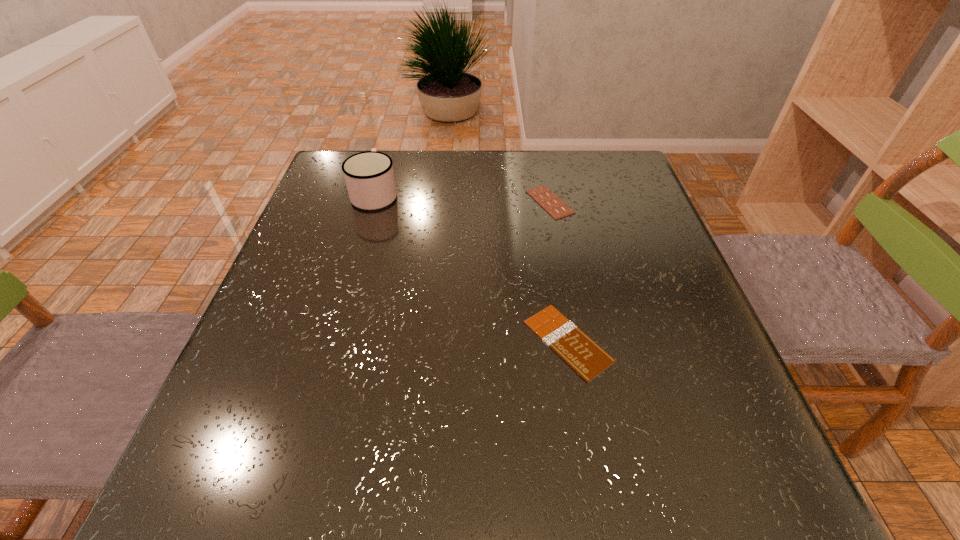
You are a GUI agent. You are given a task and a screenshot of the screen. Output one action in this format:
    pyautogui.click(x=<x>, y=<y>)
    Task: Click on the object present at the left edge
    The image size is (960, 540).
    Given the screenshot: What is the action you would take?
    pyautogui.click(x=369, y=176)

You are a GUI agent. You are given a task and a screenshot of the screen. Output one action in this format:
    pyautogui.click(x=<x>, y=<y>)
    Task: Click on the object present at the far left corner
    The width and height of the screenshot is (960, 540).
    Given the screenshot: What is the action you would take?
    pyautogui.click(x=369, y=176)

Locate an element on the screen. The width and height of the screenshot is (960, 540). vacant area at the far edge is located at coordinates (568, 156).

The height and width of the screenshot is (540, 960). Identify the location of vacant space at the near edge. (500, 513).

This screenshot has height=540, width=960. Find the location of `free point at the left edge`. free point at the left edge is located at coordinates (288, 436).

This screenshot has height=540, width=960. Find the location of `vacant area at the right edge`. vacant area at the right edge is located at coordinates (637, 293).

Image resolution: width=960 pixels, height=540 pixels. In the image, there is a desktop. What are the coordinates of `vacant space at the far left corner` in the screenshot? It's located at (346, 183).

The image size is (960, 540). In the image, there is a desktop. In order to click on vacant space at the far right corner in this screenshot , I will do `click(613, 182)`.

This screenshot has height=540, width=960. I want to click on free point between the leftmost object and the shortest object, so click(x=471, y=267).

Where is `blank region between the farther chocolate bar and the nearest object`? This screenshot has height=540, width=960. blank region between the farther chocolate bar and the nearest object is located at coordinates (559, 272).